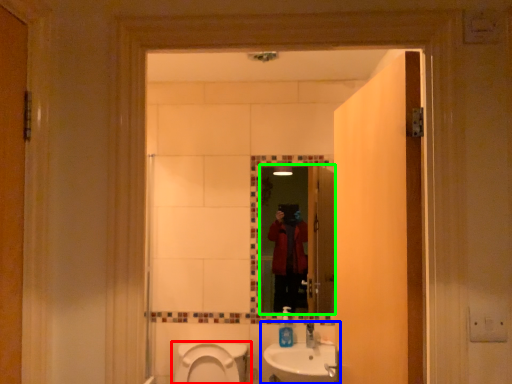
Question: Based on their relative distances, which object is nearer to toilet (highlighted by a red box)? Choose from sink (highlighted by a blue box) and mirror (highlighted by a green box).

Choices:
 (A) sink
 (B) mirror

Answer: (A)